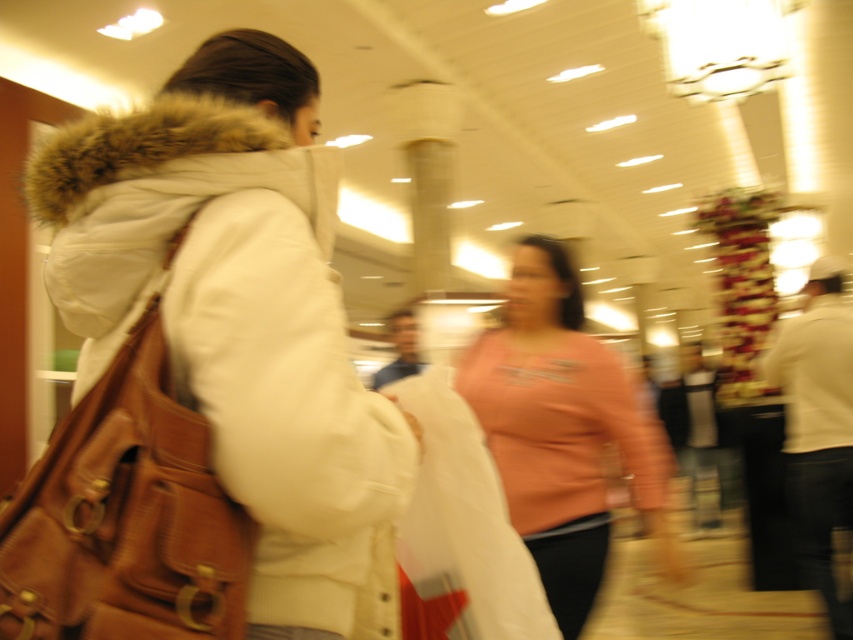
Question: Which of the following is the farthest from the observer?

Choices:
 (A) white fuzzy-lined jacket at left
 (B) brown leather bag at left

Answer: (A)

Question: Is white fuzzy-lined jacket at left smaller than brown leather bag at left?

Choices:
 (A) no
 (B) yes

Answer: (A)

Question: Which of the following is the farthest from the observer?

Choices:
 (A) (239, 273)
 (B) (213, 582)

Answer: (A)

Question: In this image, where is white fuzzy-lined jacket at left located relative to brown leather bag at left?

Choices:
 (A) left
 (B) right

Answer: (B)

Question: Estimate the real-world distances between objects in this image. Which object is farther from the white fuzzy-lined jacket at left?

Choices:
 (A) pink fabric shirt at center
 (B) brown leather bag at left

Answer: (A)

Question: Does white fuzzy-lined jacket at left have a greater width compared to pink fabric shirt at center?

Choices:
 (A) yes
 (B) no

Answer: (B)